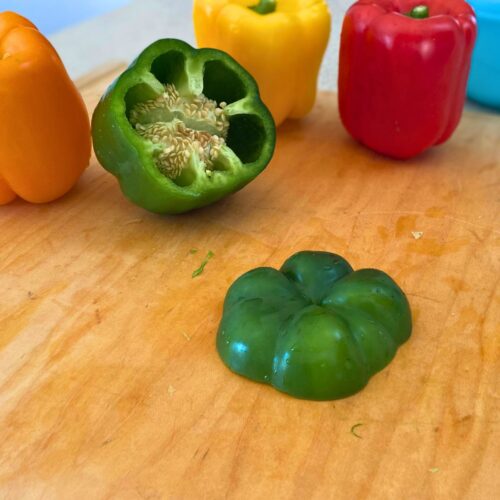
Find the location of a particular element. bowl is located at coordinates (488, 81).